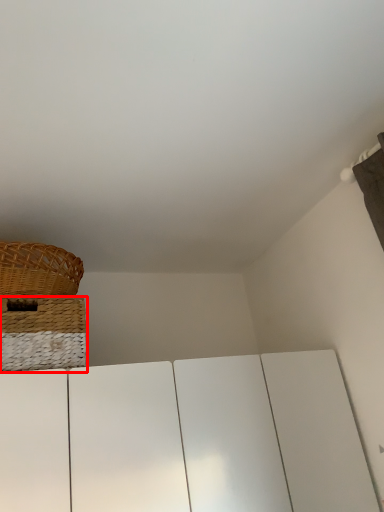
Question: From the image's perspective, what is the correct spatial positioning of basket (annotated by the red box) in reference to picnic basket?

Choices:
 (A) below
 (B) above

Answer: (A)